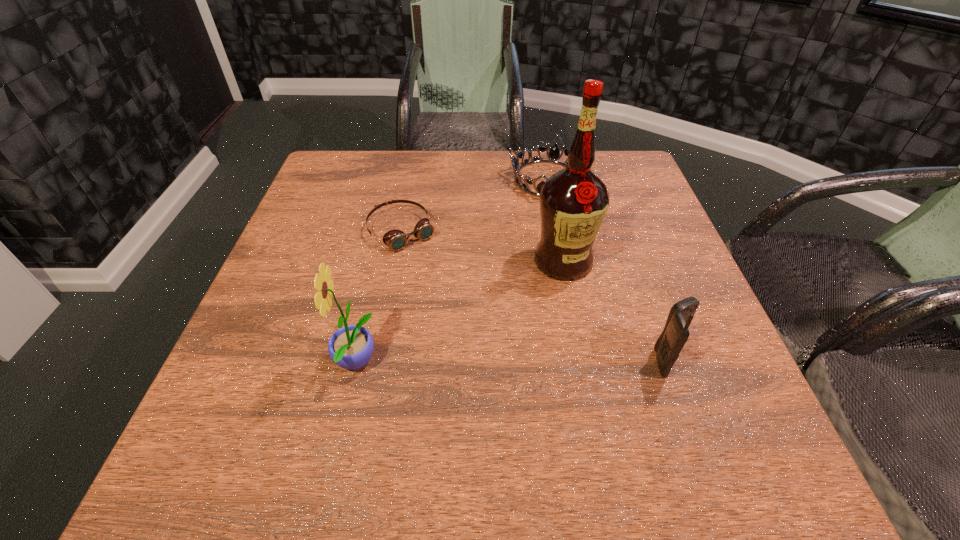
Locate an element on the screen. vacant area situated on the keyboard of the rightmost object is located at coordinates 715,361.

Identify the location of vacant space located on the front-facing side of the tiara. The height and width of the screenshot is (540, 960). (515, 278).

Locate an element on the screen. This screenshot has width=960, height=540. blank space located 0.050m on the front-facing side of the tiara is located at coordinates (537, 213).

You are a GUI agent. You are given a task and a screenshot of the screen. Output one action in this format:
    pyautogui.click(x=<x>, y=<y>)
    Task: Click on the vacant space situated 0.330m on the front-facing side of the tiara
    The image size is (960, 540).
    Given the screenshot: What is the action you would take?
    pyautogui.click(x=511, y=292)

Locate an element on the screen. The image size is (960, 540). free space located through the lenses of the goggles is located at coordinates (491, 342).

The image size is (960, 540). What are the coordinates of `free spot located 0.400m through the lenses of the goggles` in the screenshot? It's located at (522, 382).

Locate an element on the screen. The height and width of the screenshot is (540, 960). blank space located through the lenses of the goggles is located at coordinates (509, 366).

I want to click on vacant region located on the label of the tallest object, so click(x=536, y=317).

Identify the location of vacant region located on the label of the tallest object. (500, 392).

Identify the location of free location located 0.200m on the label of the tallest object. (519, 352).